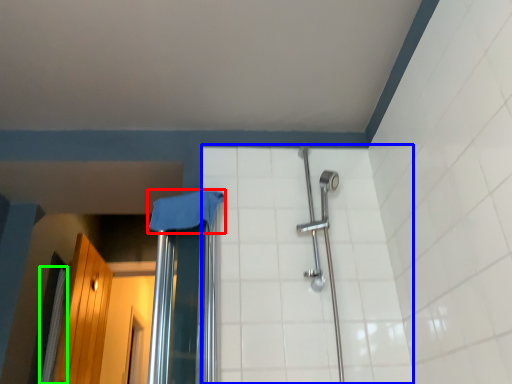
Question: Based on their relative distances, which object is nearer to cloth (highlighted by a red box)? Choose from ceramic tile (highlighted by a blue box) and shower curtain (highlighted by a green box).

Choices:
 (A) ceramic tile
 (B) shower curtain

Answer: (A)